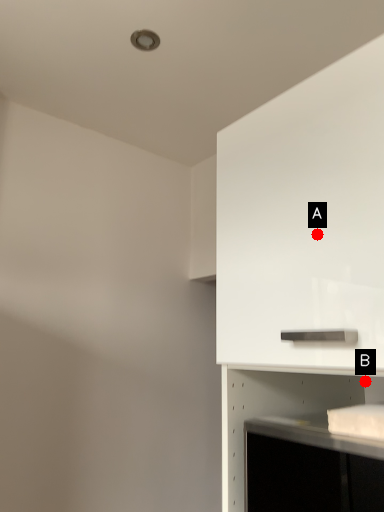
Question: Two points are circled on the image, labeled by A and B beside each circle. Which of the following is the farthest from the observer?

Choices:
 (A) A is further
 (B) B is further

Answer: (B)